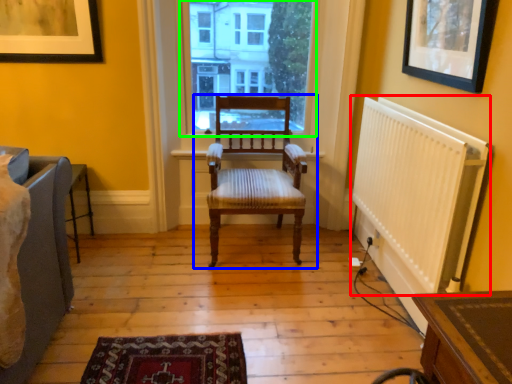
Question: Which object is positioned closest to radiator (highlighted by a red box)? Select from chair (highlighted by a blue box) and window (highlighted by a green box).

Choices:
 (A) chair
 (B) window

Answer: (A)